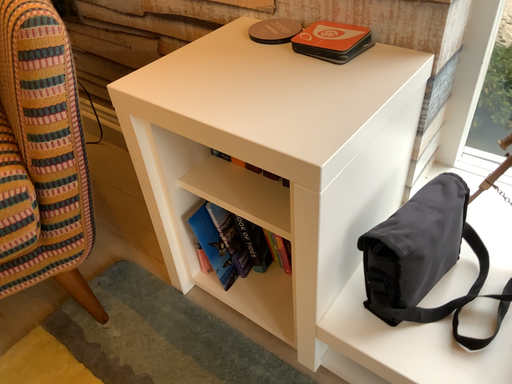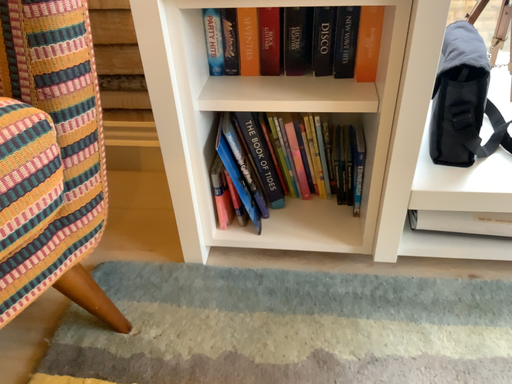
Question: How did the camera likely rotate when shooting the video?

Choices:
 (A) rotated upward
 (B) rotated downward

Answer: (A)